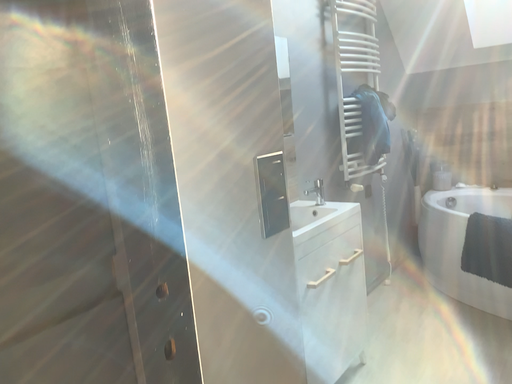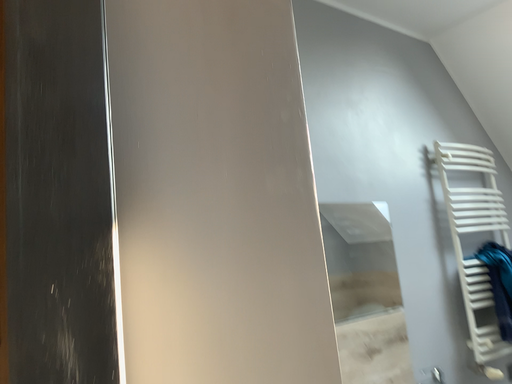
Question: How did the camera likely rotate when shooting the video?

Choices:
 (A) rotated right
 (B) rotated left

Answer: (B)